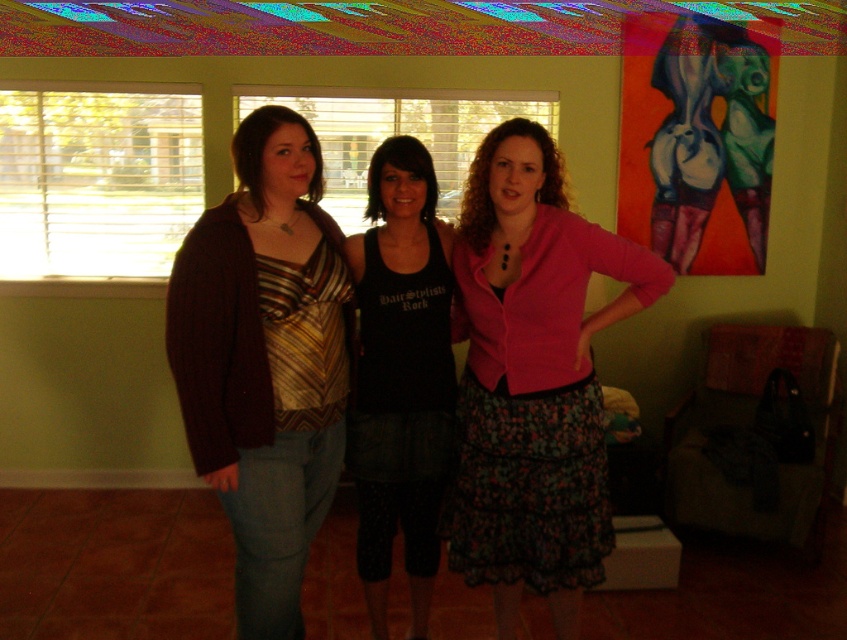
Question: Which object is the farthest from the matte brown cardigan at center?

Choices:
 (A) pink matte cardigan at center
 (B) black tank top at center

Answer: (A)

Question: Is pink matte cardigan at center below matte brown cardigan at center?

Choices:
 (A) yes
 (B) no

Answer: (A)

Question: Is pink matte cardigan at center bigger than black tank top at center?

Choices:
 (A) yes
 (B) no

Answer: (A)

Question: Which object is farther from the camera taking this photo?

Choices:
 (A) matte brown cardigan at center
 (B) black tank top at center

Answer: (B)

Question: Among these objects, which one is nearest to the camera?

Choices:
 (A) pink matte cardigan at center
 (B) matte brown cardigan at center
 (C) black tank top at center

Answer: (B)

Question: In this image, where is pink matte cardigan at center located relative to matte brown cardigan at center?

Choices:
 (A) below
 (B) above

Answer: (A)